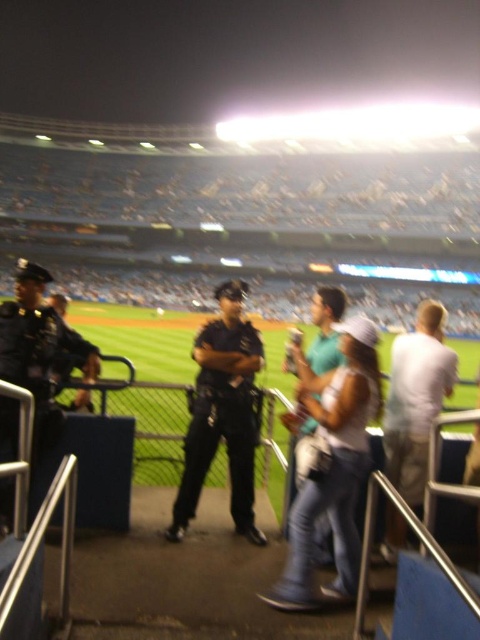
Does white cotton shirt at right come behind teal fabric shirt at center?

Yes, white cotton shirt at right is behind teal fabric shirt at center.

Which is in front, point (422, 497) or point (323, 307)?

Point (422, 497)

This screenshot has width=480, height=640. I want to click on white cotton shirt at right, so click(x=416, y=400).

Can you confirm if dark blue uniform at center is positioned to the left of dark blue uniform at left?

No, dark blue uniform at center is not to the left of dark blue uniform at left.

Looking at this image, does dark blue uniform at center have a larger size compared to dark blue uniform at left?

Actually, dark blue uniform at center might be smaller than dark blue uniform at left.

Which is behind, point (199, 484) or point (36, 356)?

Positioned behind is point (199, 484).

Identify the location of dark blue uniform at center. (222, 413).

Does point (55, 362) come farther from viewer compared to point (312, 321)?

No.

Does dark blue uniform at left appear over teal fabric shirt at center?

Actually, dark blue uniform at left is below teal fabric shirt at center.

Between point (13, 328) and point (331, 332), which one is positioned in front?

Point (13, 328)

Locate an element on the screen. dark blue uniform at left is located at coordinates (39, 348).